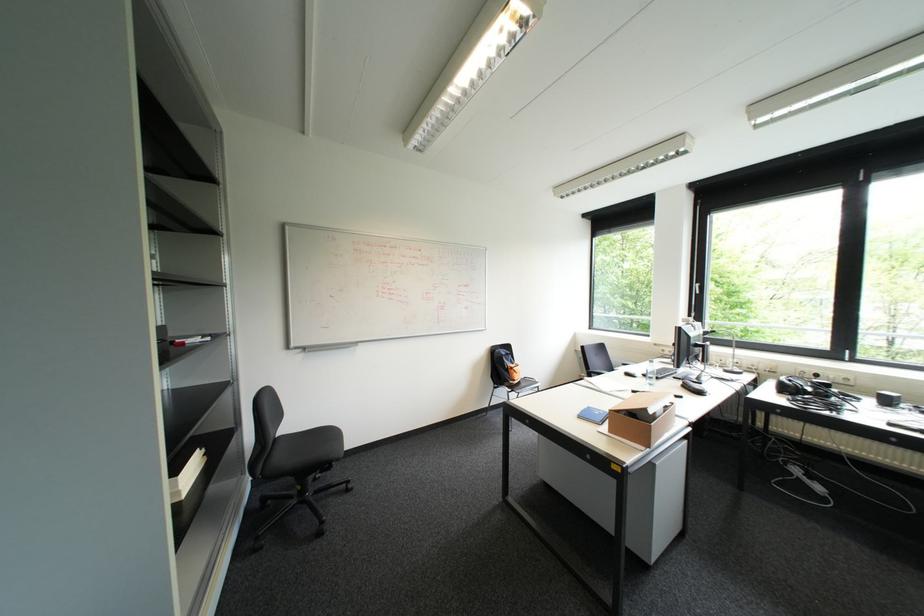
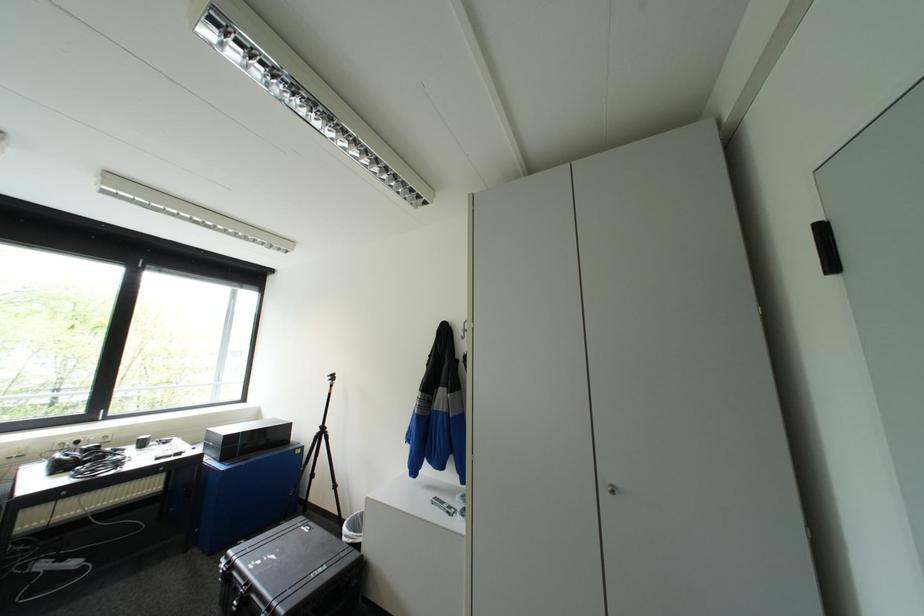
Question: The camera is either moving clockwise (left) or counter-clockwise (right) around the object. The first image is from the beginning of the video and the second image is from the end. Is the camera moving left or right when shooting the video?

Choices:
 (A) Left
 (B) Right

Answer: (A)